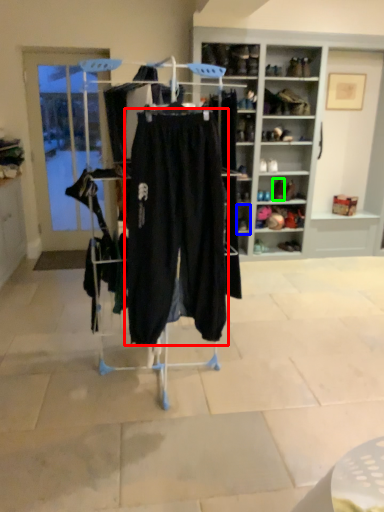
Question: Which is farther away from trousers (highlighted by a red box)? shelf (highlighted by a blue box) or footwear (highlighted by a green box)?

Choices:
 (A) shelf
 (B) footwear

Answer: (B)